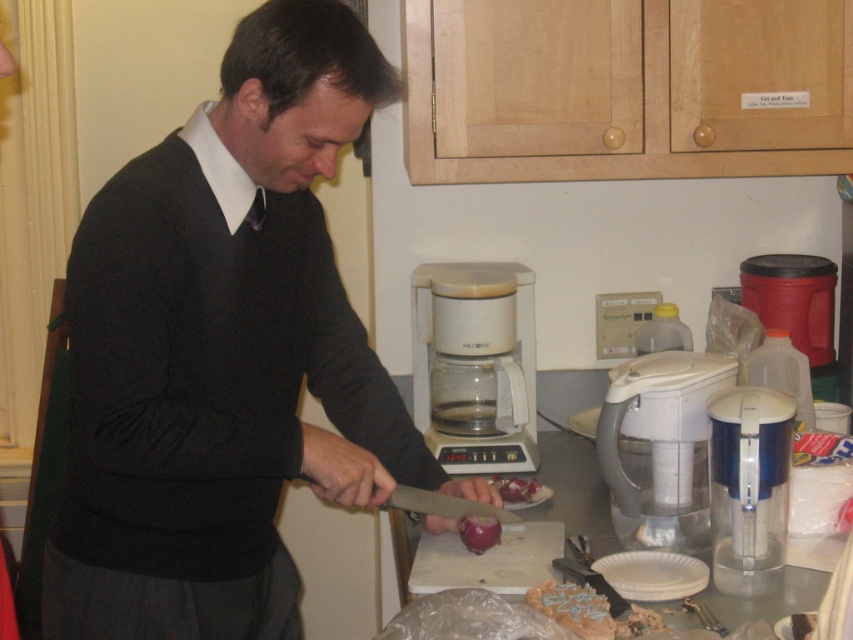
Question: Can you confirm if white plastic blender at center is bigger than shiny brown bread at lower center?

Choices:
 (A) yes
 (B) no

Answer: (A)

Question: Can you confirm if white plastic cutting board at center is positioned above red translucent onion at lower center?

Choices:
 (A) yes
 (B) no

Answer: (B)

Question: Which object appears closest to the camera in this image?

Choices:
 (A) transparent plastic coffee maker at center
 (B) translucent plastic cutting board at center
 (C) shiny brown bread at lower center

Answer: (C)

Question: Which object is closer to the camera taking this photo?

Choices:
 (A) red translucent onion at lower center
 (B) red smooth onion at lower center
 (C) shiny brown bread at lower center

Answer: (C)

Question: Among these objects, which one is farthest from the camera?

Choices:
 (A) translucent plastic cutting board at center
 (B) white plastic blender at center

Answer: (B)

Question: Can you confirm if matte black sweater at center is smaller than white plastic blender at center?

Choices:
 (A) yes
 (B) no

Answer: (B)